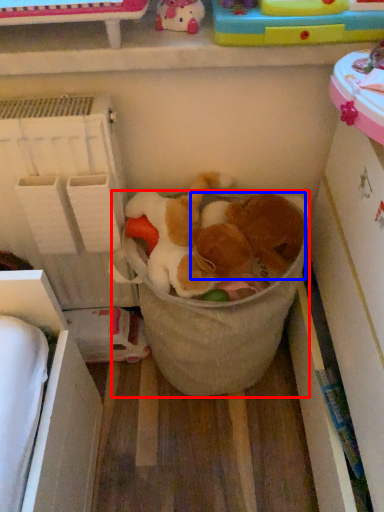
Question: Which of the following is the closest to the observer, laundry basket (highlighted by a red box) or animal (highlighted by a blue box)?

Choices:
 (A) laundry basket
 (B) animal

Answer: (B)